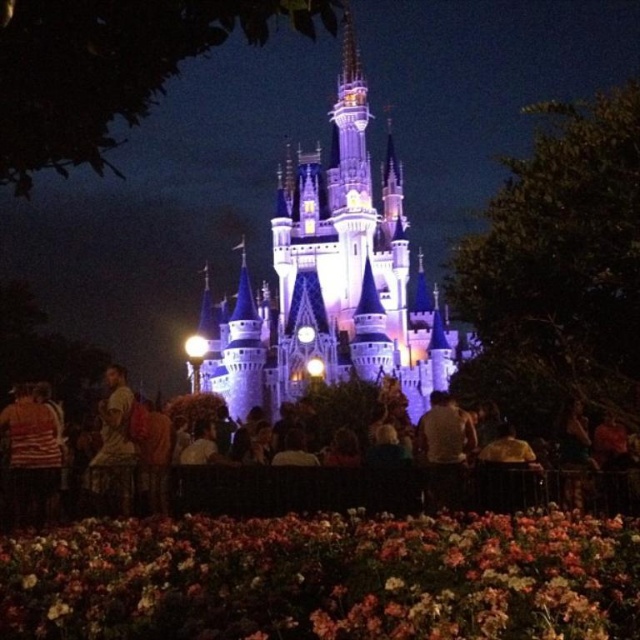
Question: Where is multicolored fabric flowers at lower center located in relation to illuminated stone castle at center in the image?

Choices:
 (A) left
 (B) right

Answer: (A)

Question: Which is farther from the dark brown leather jacket at lower left?

Choices:
 (A) light brown backpack at center
 (B) multicolored fabric flowers at lower center

Answer: (B)

Question: Can you confirm if multicolored fabric flowers at lower center is positioned to the left of dark brown leather jacket at lower left?

Choices:
 (A) yes
 (B) no

Answer: (B)

Question: Which point is closer to the camera taking this photo?

Choices:
 (A) (348, 244)
 (B) (579, 568)
 (C) (404, 464)

Answer: (B)

Question: Which point is closer to the camera?

Choices:
 (A) (412, 408)
 (B) (122, 401)
 (C) (506, 624)
 (D) (285, 477)

Answer: (C)

Question: Is light brown backpack at center further to camera compared to dark brown leather jacket at lower left?

Choices:
 (A) yes
 (B) no

Answer: (B)